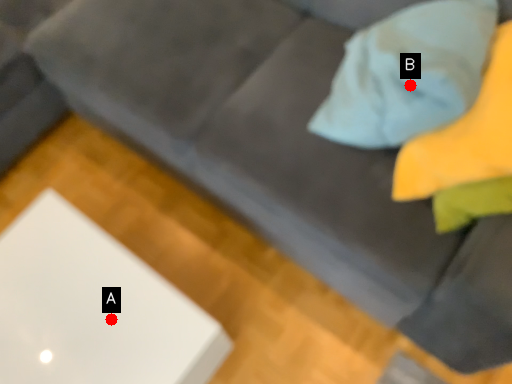
Question: Two points are circled on the image, labeled by A and B beside each circle. Which point is closer to the camera?

Choices:
 (A) A is closer
 (B) B is closer

Answer: (B)